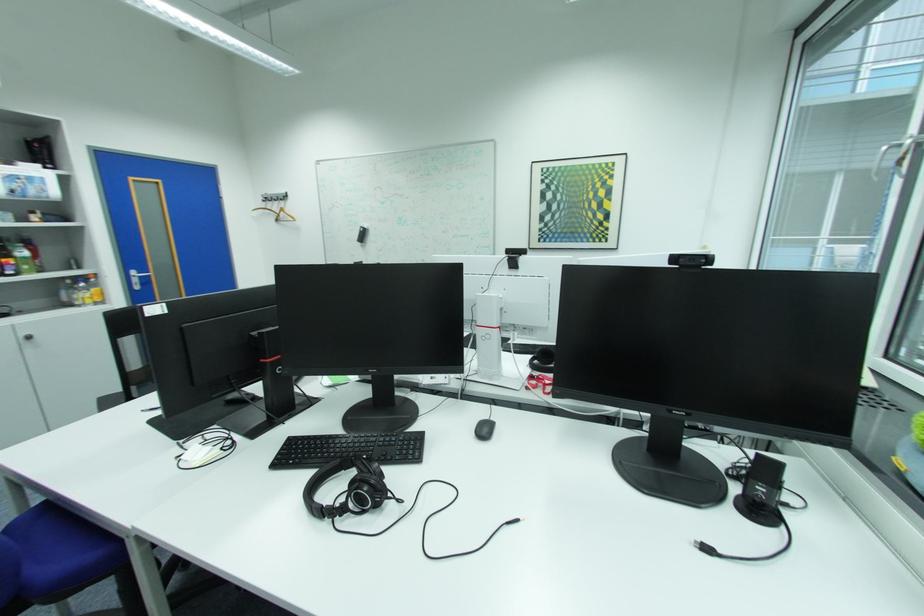
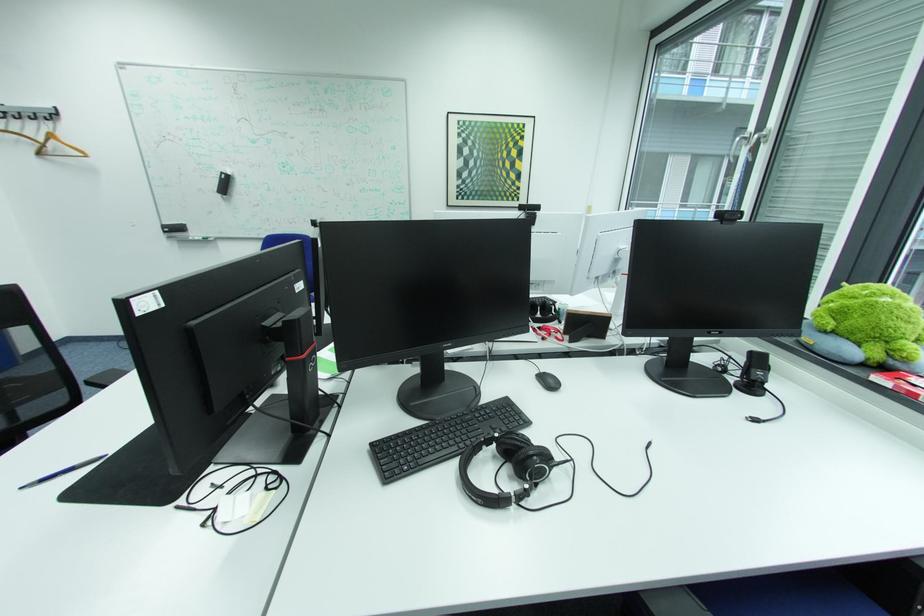
In the second image, find the point that corresponds to point (188, 444) in the first image.

(187, 508)